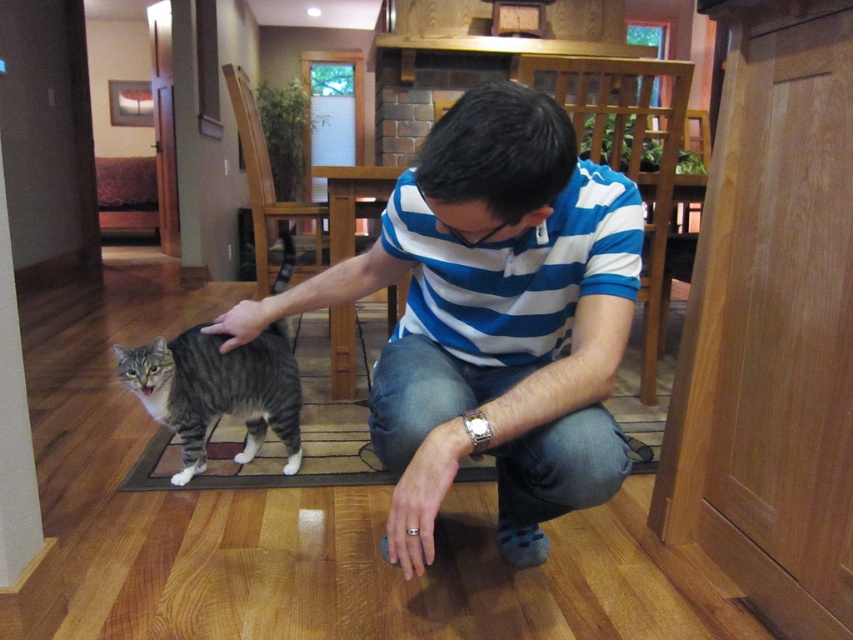
Is blue striped shirt at center thinner than striped fur cat at center?

In fact, blue striped shirt at center might be wider than striped fur cat at center.

Between blue striped shirt at center and striped fur cat at center, which one has less height?

Standing shorter between the two is striped fur cat at center.

Who is more distant from viewer, [584,422] or [119,380]?

The point [119,380] is behind.

Where is `blue striped shirt at center`? This screenshot has width=853, height=640. blue striped shirt at center is located at coordinates (492, 320).